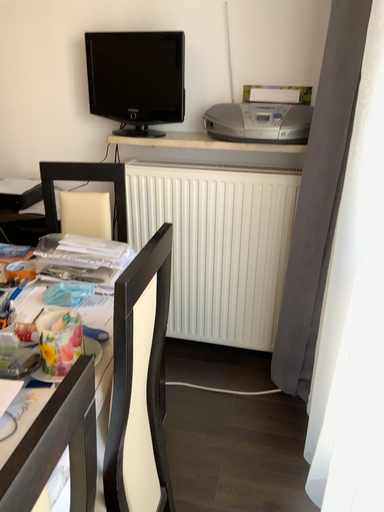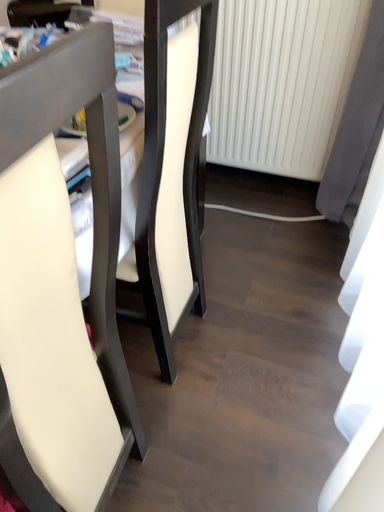
Question: How did the camera likely rotate when shooting the video?

Choices:
 (A) rotated left
 (B) rotated right

Answer: (A)